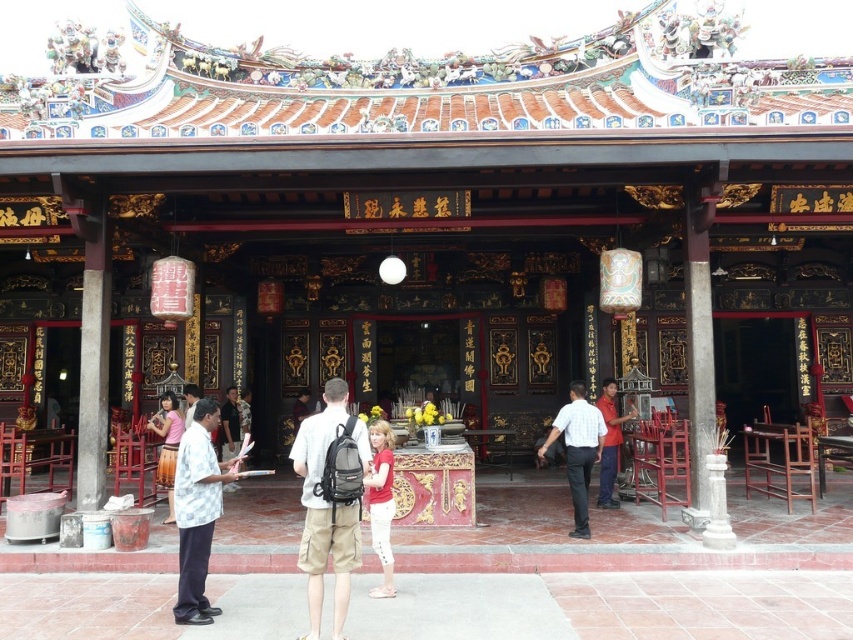
Question: Which point appears closest to the camera in this image?

Choices:
 (A) (318, 628)
 (B) (234, 388)

Answer: (A)

Question: Where is matte red shirt at center located in relation to light brown leather jacket at center in the image?

Choices:
 (A) above
 (B) below

Answer: (B)

Question: Among these points, which one is farthest from the camera?

Choices:
 (A) (234, 387)
 (B) (236, 474)

Answer: (A)

Question: Is matte red shirt at center closer to the viewer compared to light brown leather jacket at center?

Choices:
 (A) no
 (B) yes

Answer: (B)

Question: Is white cotton shirt at center in front of red shirt at center?

Choices:
 (A) yes
 (B) no

Answer: (A)

Question: Which of these objects is positioned farthest from the light brown leather jacket at center?

Choices:
 (A) white cotton shirt at center
 (B) red shirt at center

Answer: (B)